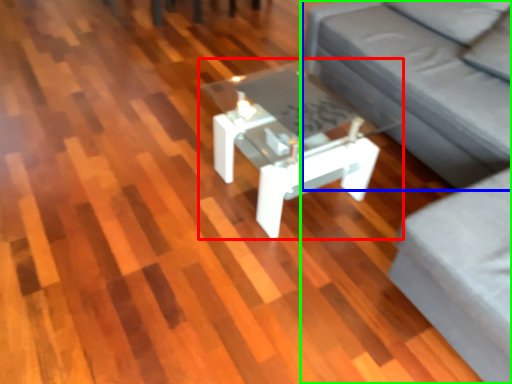
Question: Which object is the closest to the coffee table (highlighted by a red box)? Choose among these: couch (highlighted by a blue box) or studio couch (highlighted by a green box).

Choices:
 (A) couch
 (B) studio couch

Answer: (A)